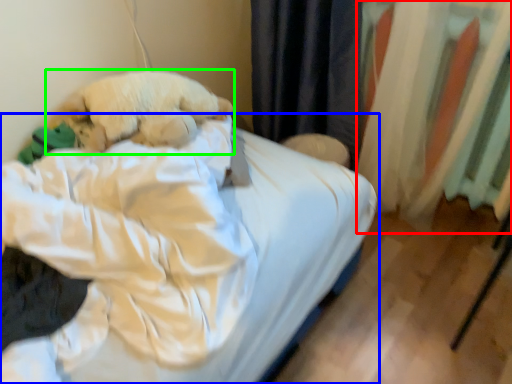
Question: Based on their relative distances, which object is nearer to curtain (highlighted by a red box)? Choose from bed (highlighted by a blue box) and dog (highlighted by a green box).

Choices:
 (A) bed
 (B) dog

Answer: (A)